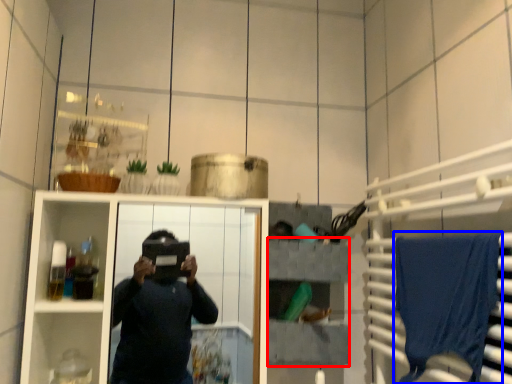
Question: Which object is further to the camera taking this photo, shelf (highlighted by a red box) or bath towel (highlighted by a blue box)?

Choices:
 (A) shelf
 (B) bath towel

Answer: (A)